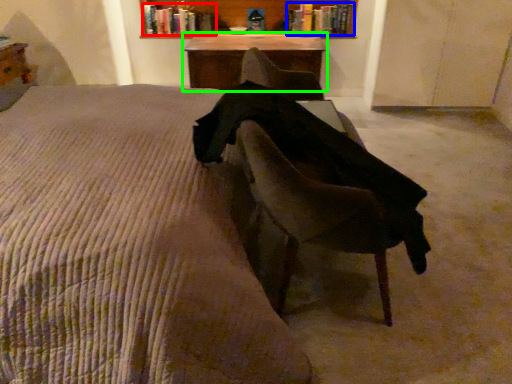
Question: Considering the real-world distances, which object is farthest from book (highlighted by a red box)? book (highlighted by a blue box) or table (highlighted by a green box)?

Choices:
 (A) book
 (B) table

Answer: (A)